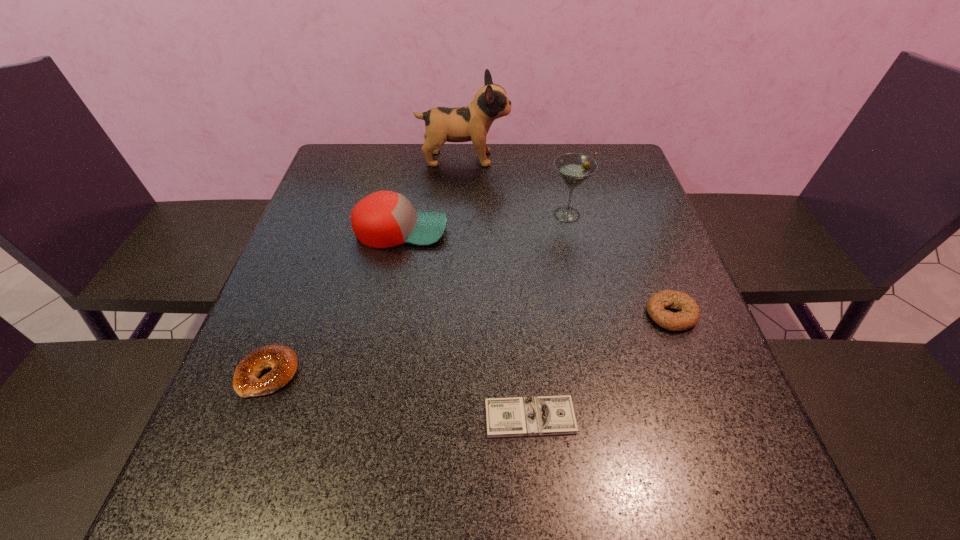
Locate an element on the screen. The width and height of the screenshot is (960, 540). blank region between the third tallest object and the tallest object is located at coordinates (432, 194).

You are a GUI agent. You are given a task and a screenshot of the screen. Output one action in this format:
    pyautogui.click(x=<x>, y=<y>)
    Task: Click on the vacant area that lies between the puppy and the left bagel
    
    Given the screenshot: What is the action you would take?
    pyautogui.click(x=366, y=266)

Locate an element on the screen. The height and width of the screenshot is (540, 960). vacant space that's between the farthest object and the third nearest object is located at coordinates (567, 237).

Image resolution: width=960 pixels, height=540 pixels. Find the location of `vacant space in between the farther bagel and the fifth shortest object`. vacant space in between the farther bagel and the fifth shortest object is located at coordinates (619, 265).

You are a GUI agent. You are given a task and a screenshot of the screen. Output one action in this format:
    pyautogui.click(x=<x>, y=<y>)
    Task: Click on the vacant area that lies between the martini and the tallest object
    This screenshot has width=960, height=540.
    Given the screenshot: What is the action you would take?
    pyautogui.click(x=516, y=187)

At what (x,y) coordinates should I click in order to perform the action: click on vacant space that is in between the baseball cap and the second tallest object. Please return your answer as a coordinate pair (x, y). This screenshot has height=540, width=960. Looking at the image, I should click on (484, 222).

Identify the location of object that can be found as the fourth closest to the second object from right to left. Image resolution: width=960 pixels, height=540 pixels. (545, 415).

Locate which object is the third closest to the third nearest object. Please provide its 2D coordinates. Your answer should be formatted as a tuple, i.e. [(x, y)], where the tuple contains the x and y coordinates of a point satisfying the conditions above.

[(383, 219)]

At what (x,y) coordinates should I click in order to perform the action: click on blank space that satisfies the following two spatial constraints: 1. on the back side of the shortest object; 2. on the right side of the second object from right to left. Please return your answer as a coordinate pair (x, y). The width and height of the screenshot is (960, 540). Looking at the image, I should click on (513, 215).

Where is `vacant position in the image that satisfies the following two spatial constraints: 1. at the brim of the baseball cap; 2. on the right side of the dollar`? Image resolution: width=960 pixels, height=540 pixels. vacant position in the image that satisfies the following two spatial constraints: 1. at the brim of the baseball cap; 2. on the right side of the dollar is located at coordinates (365, 417).